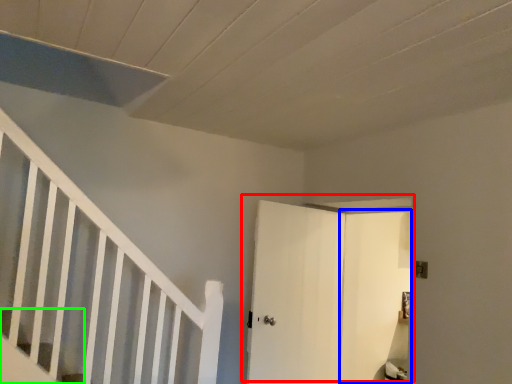
Question: Considering the real-world distances, which object is farthest from door (highlighted by a red box)? door (highlighted by a blue box) or stairs (highlighted by a green box)?

Choices:
 (A) door
 (B) stairs

Answer: (B)